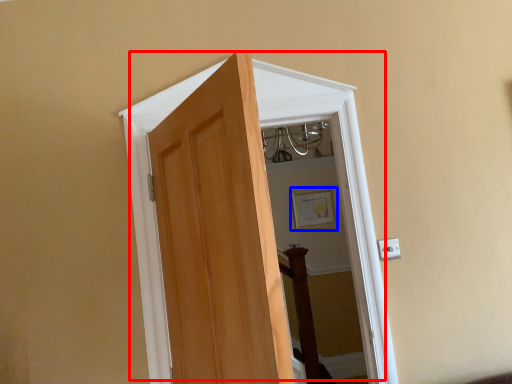
Question: Which point is closer to the camera, door (highlighted by a red box) or picture frame (highlighted by a blue box)?

Choices:
 (A) door
 (B) picture frame

Answer: (A)